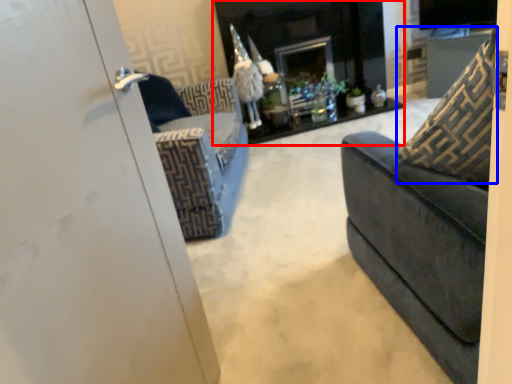
Question: Which object is closer to the camera taking this photo, fireplace (highlighted by a red box) or throw pillow (highlighted by a blue box)?

Choices:
 (A) fireplace
 (B) throw pillow

Answer: (B)